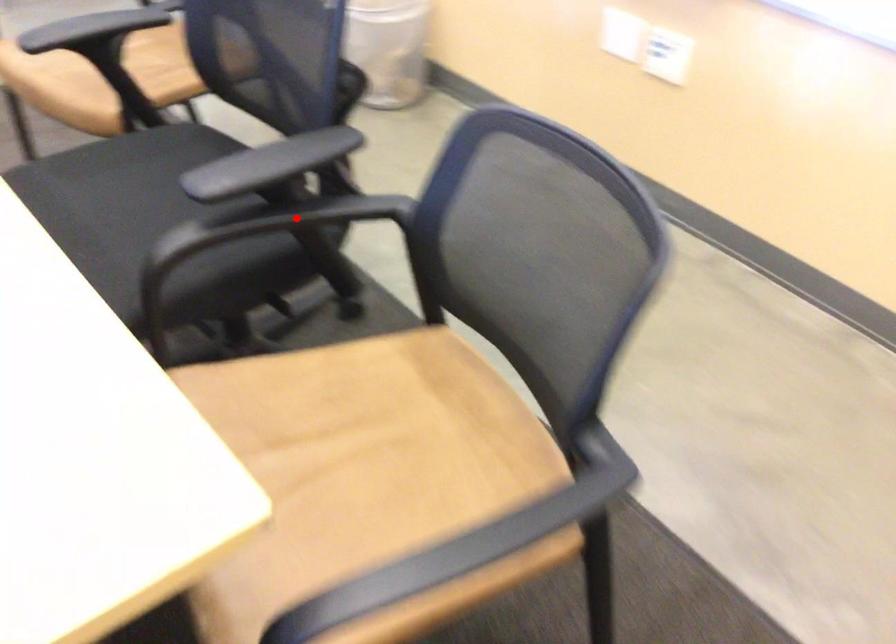
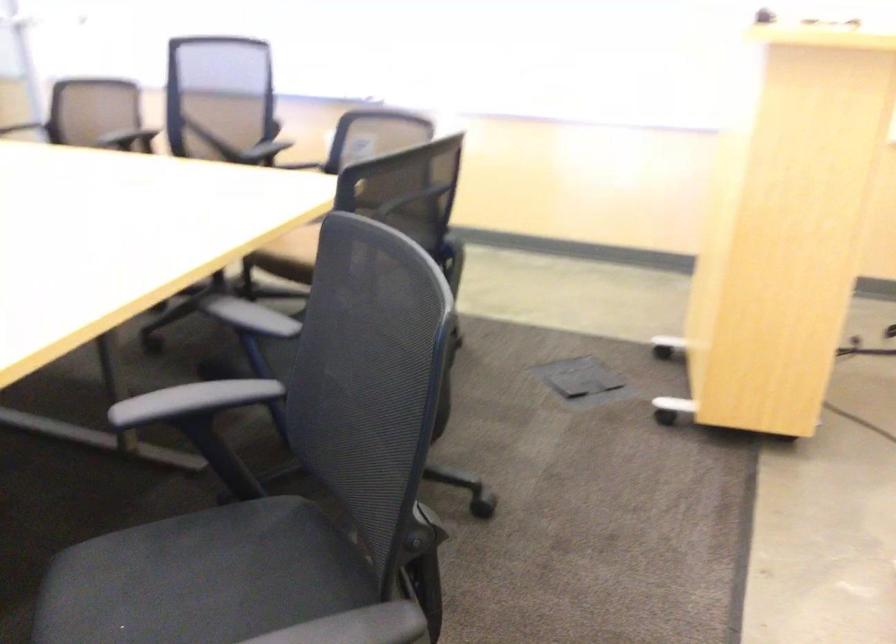
Question: I am providing you with two images of the same scene from different viewpoints. A red point is marked on the first image. Is the red point's position out of view in image 2?

Choices:
 (A) Yes
 (B) No

Answer: (A)